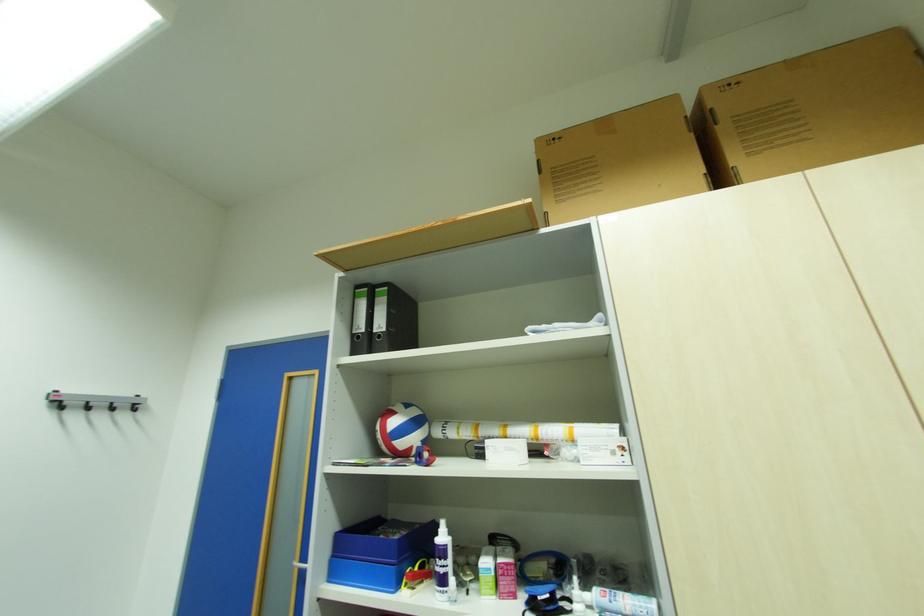
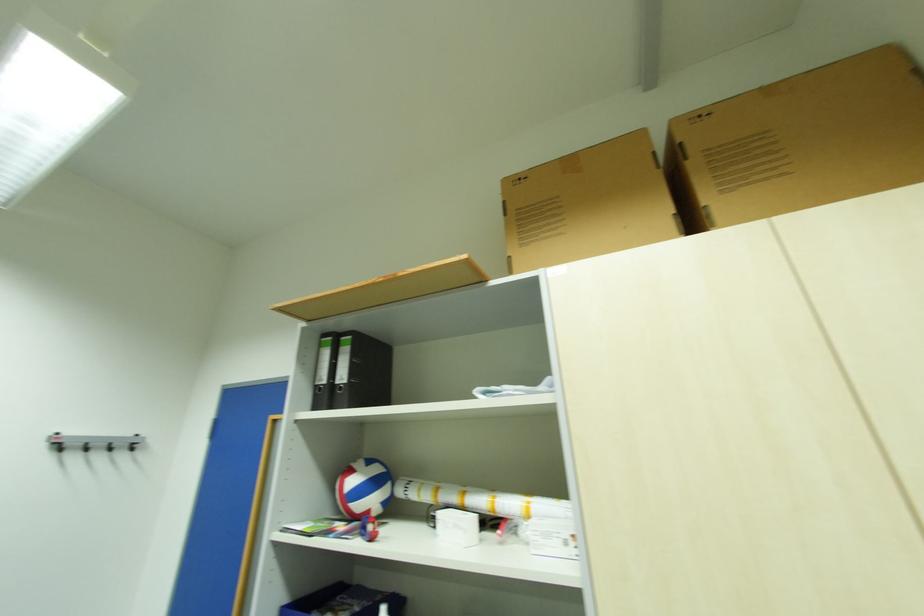
Question: The images are taken continuously from a first-person perspective. In which direction are you moving?

Choices:
 (A) Left
 (B) Right
 (C) Forward
 (D) Backward

Answer: (B)